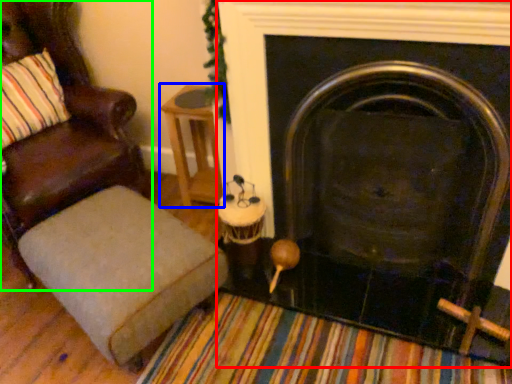
Question: Which is nearer to the fireplace (highlighted by a red box)? side table (highlighted by a blue box) or chair (highlighted by a green box).

Choices:
 (A) side table
 (B) chair

Answer: (A)